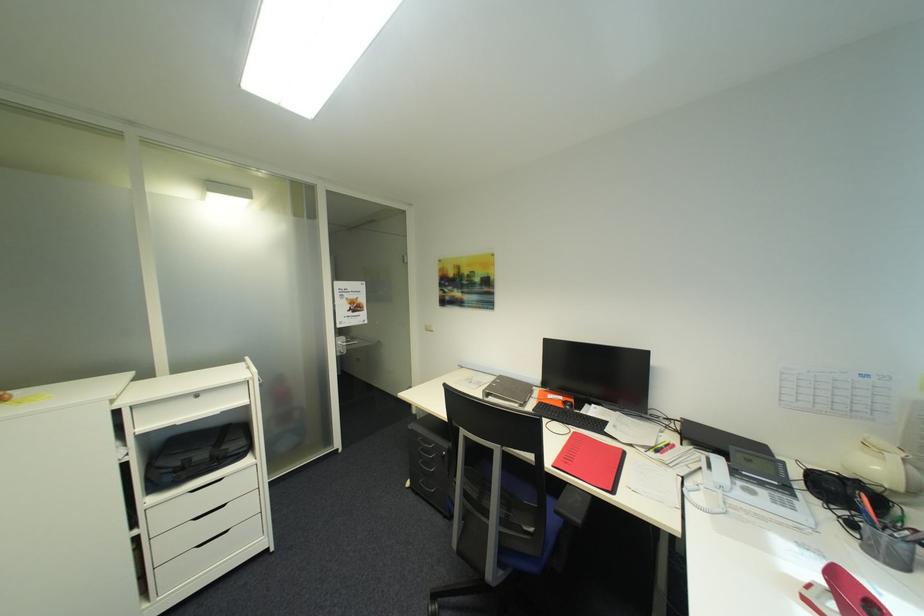
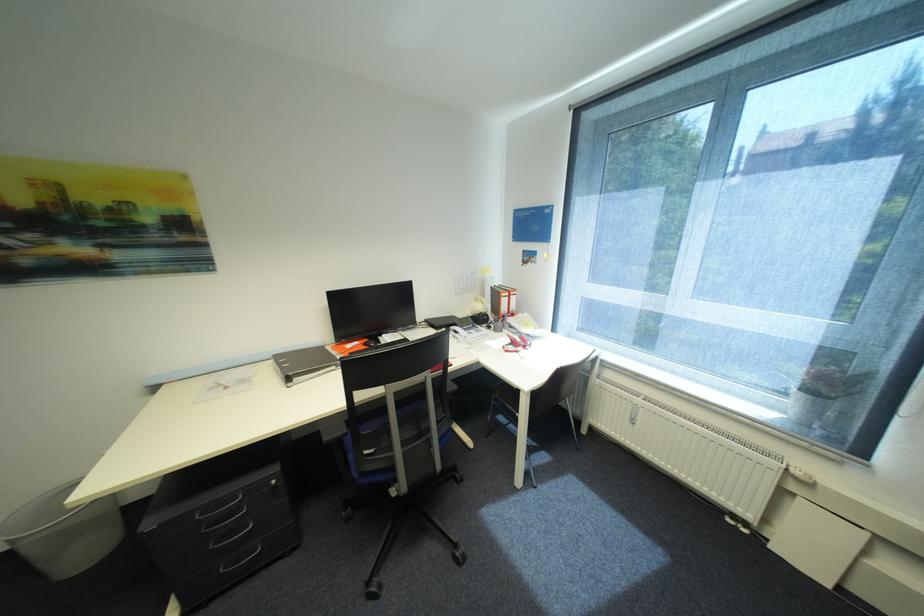
Find the pixel in the second image that matches pixel 859 525 in the first image.

(496, 328)